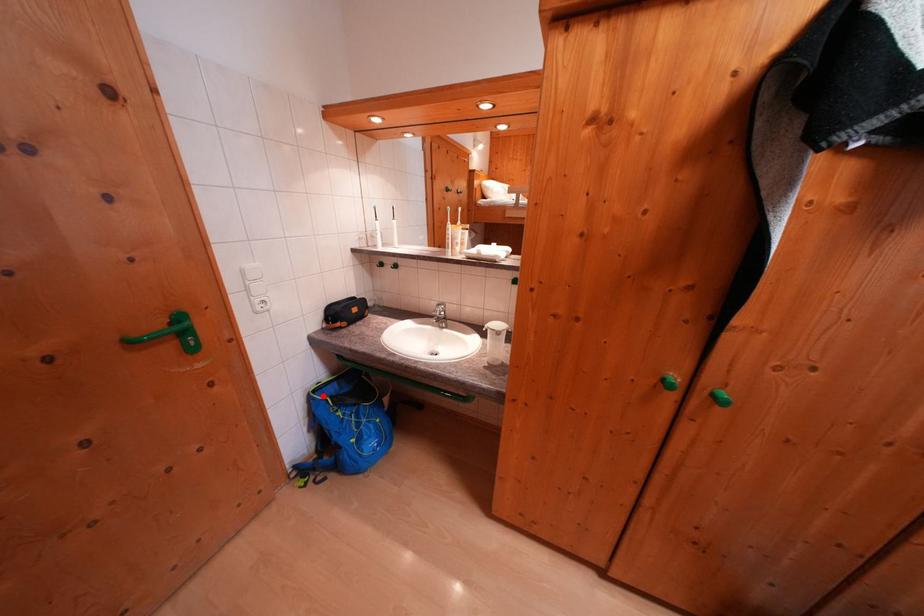
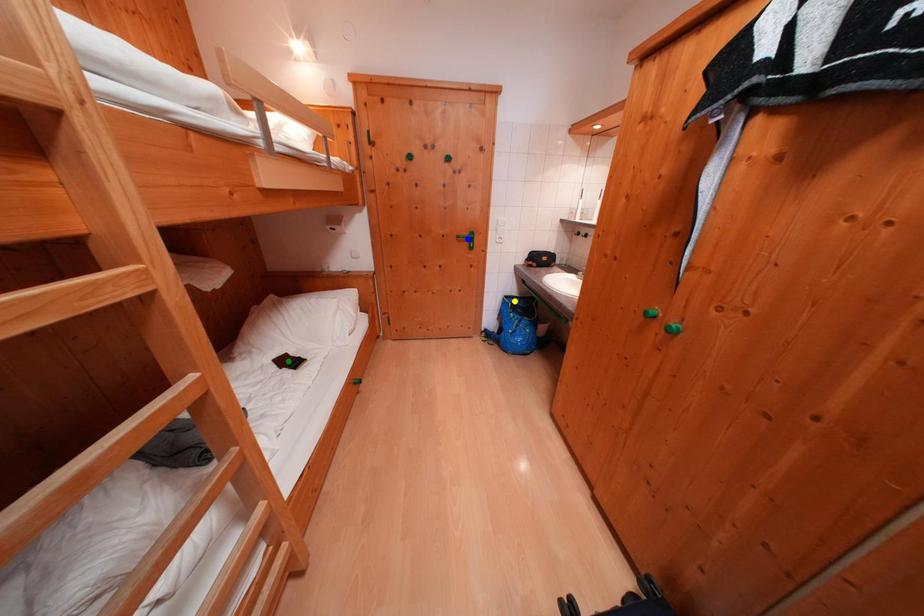
Question: I am providing you with two images of the same scene from different viewpoints. A red point is marked on the first image. You are given multiple points on the second image. Which point in image 2 is actually the same real-world point as the red point in image 1?

Choices:
 (A) yellow point
 (B) green point
 (C) blue point

Answer: (A)